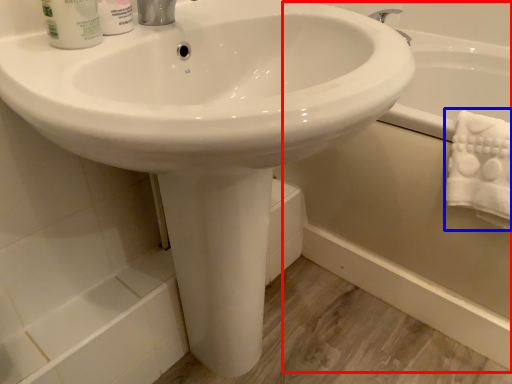
Question: Which object is further to the camera taking this photo, bath (highlighted by a red box) or bath towel (highlighted by a blue box)?

Choices:
 (A) bath
 (B) bath towel

Answer: (A)